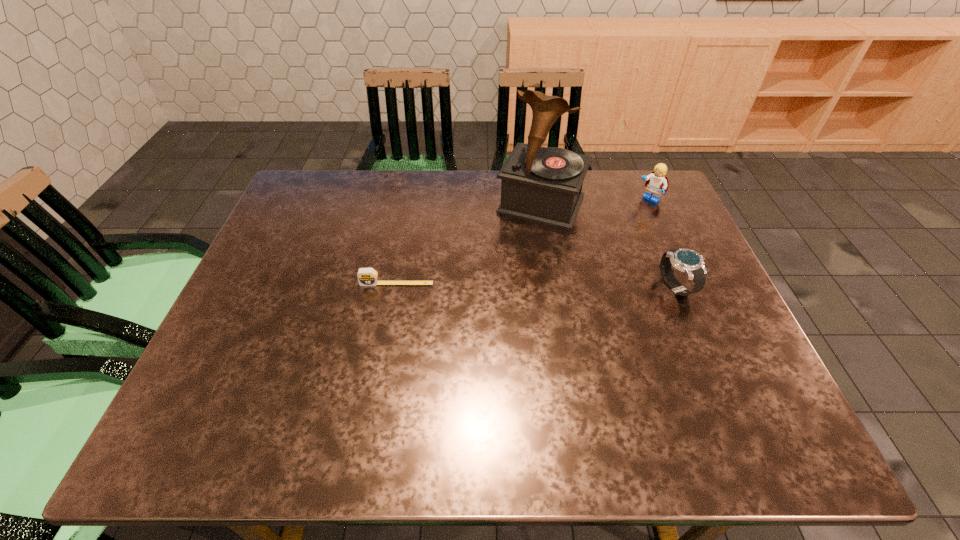
Locate an element on the screen. The height and width of the screenshot is (540, 960). vacant area that lies between the leftmost object and the second tallest object is located at coordinates pos(522,241).

The width and height of the screenshot is (960, 540). Find the location of `free space between the tape measure and the watch`. free space between the tape measure and the watch is located at coordinates (537, 285).

Find the location of `free area in between the watch and the third object from right to left`. free area in between the watch and the third object from right to left is located at coordinates (609, 246).

You are a GUI agent. You are given a task and a screenshot of the screen. Output one action in this format:
    pyautogui.click(x=<x>, y=<y>)
    Task: Click on the empty space that is in between the leftmost object and the third object from right to left
    This screenshot has height=540, width=960.
    Given the screenshot: What is the action you would take?
    pyautogui.click(x=468, y=244)

Find the location of `object identified as the closest to the watch`. object identified as the closest to the watch is located at coordinates [x=543, y=185].

Identify which object is the third closest to the watch. Please provide its 2D coordinates. Your answer should be formatted as a tuple, i.e. [(x, y)], where the tuple contains the x and y coordinates of a point satisfying the conditions above.

[(366, 276)]

Locate an element on the screen. vacant region that satisfies the following two spatial constraints: 1. on the back side of the third shortest object; 2. on the right side of the watch is located at coordinates (639, 199).

The image size is (960, 540). What are the coordinates of `free spot that satisfies the following two spatial constraints: 1. on the front side of the phonograph_record; 2. on the right side of the second shortest object` in the screenshot? It's located at pos(554,287).

Find the location of a particular element. Image resolution: width=960 pixels, height=540 pixels. free point that satisfies the following two spatial constraints: 1. at the front of the second shortest object with the tape extended; 2. on the right side of the shortest object is located at coordinates (396, 287).

The height and width of the screenshot is (540, 960). What are the coordinates of `free location that satisfies the following two spatial constraints: 1. on the front side of the tallest object; 2. on the left side of the watch` in the screenshot? It's located at (554, 287).